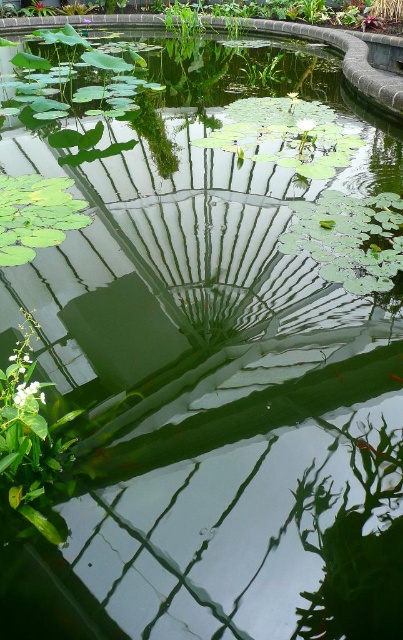
Question: In this image, where is green leafy plant at lower right located relative to green leafy plant at upper center?

Choices:
 (A) above
 (B) below

Answer: (B)

Question: Is green leafy plant at lower right smaller than green leafy plant at upper center?

Choices:
 (A) no
 (B) yes

Answer: (B)

Question: Is green leafy plant at lower right wider than green glossy lily pad at upper left?

Choices:
 (A) yes
 (B) no

Answer: (B)

Question: Which object appears farthest from the camera in this image?

Choices:
 (A) green leafy plant at lower right
 (B) green glossy lily pad at upper left
 (C) green leafy plant at upper center

Answer: (C)

Question: Which of the following is the farthest from the observer?

Choices:
 (A) green glossy lily pad at upper left
 (B) green leafy plant at upper center

Answer: (B)

Question: Which object appears farthest from the camera in this image?

Choices:
 (A) green leafy plant at upper center
 (B) green leafy plant at lower right
 (C) green glossy lily pad at upper left

Answer: (A)